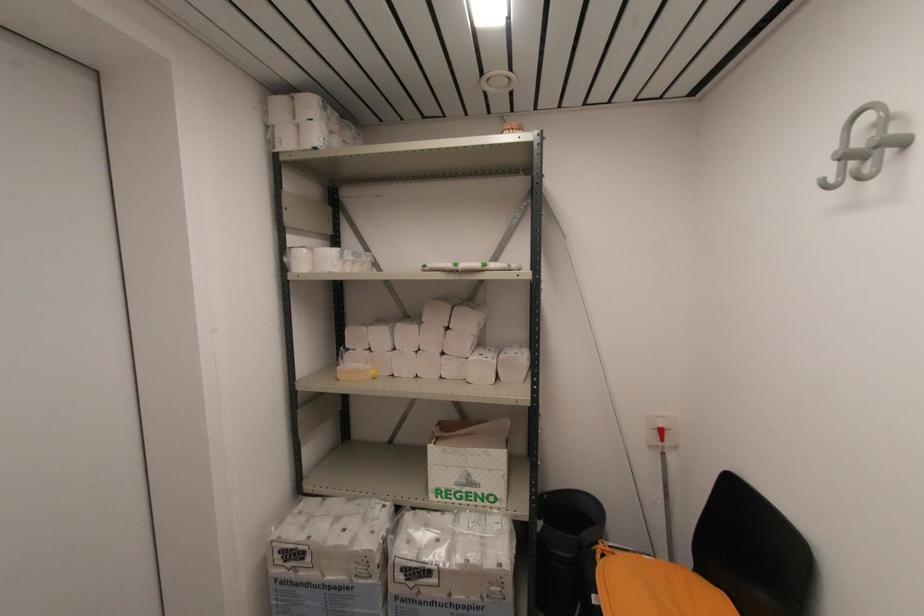
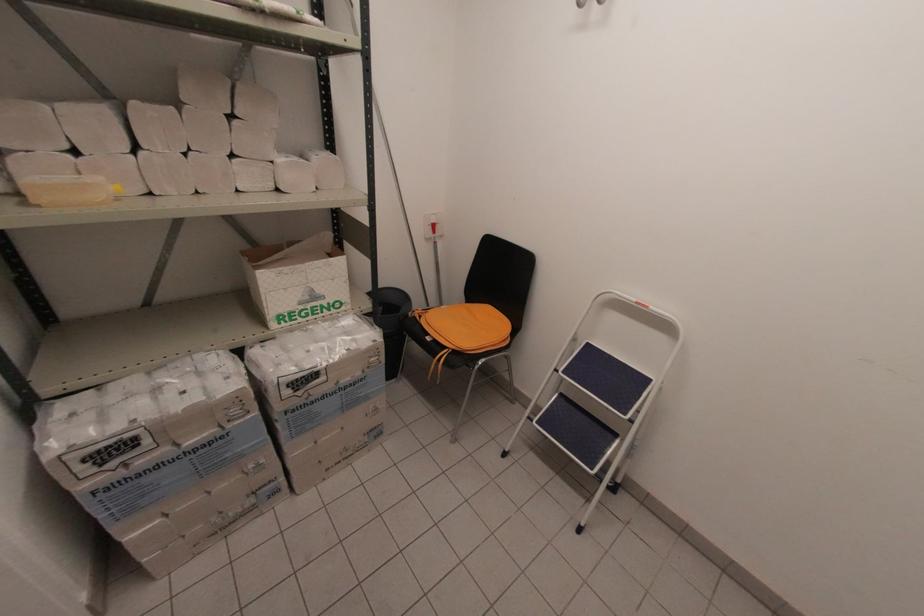
How did the camera likely rotate?

The camera rotated toward right-down.